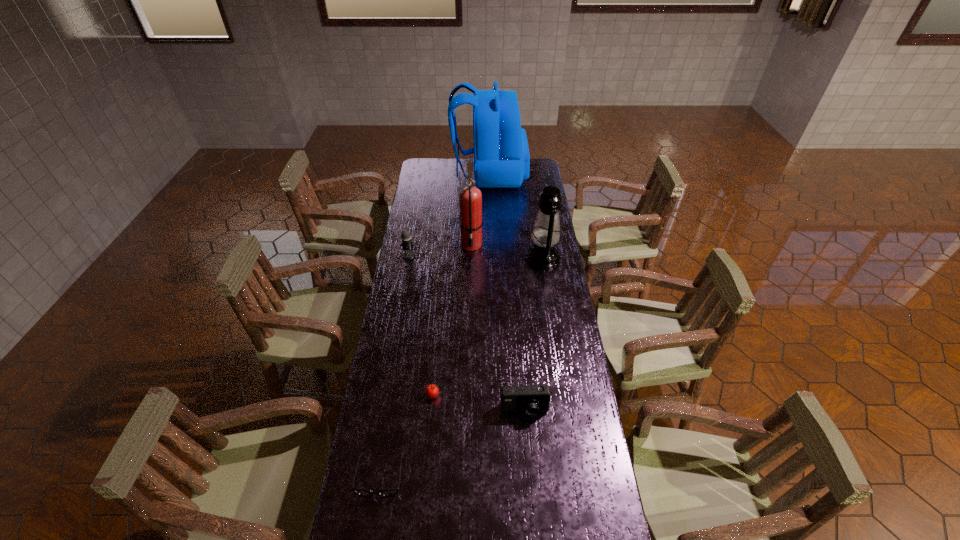
You are a GUI agent. You are given a task and a screenshot of the screen. Output one action in this format:
    pyautogui.click(x=<x>, y=<y>)
    Task: Click on the blank region between the oil lamp and the cherry
    
    Given the screenshot: What is the action you would take?
    pyautogui.click(x=488, y=327)

Locate an element on the screen. The image size is (960, 540). empty space that is in between the fire extinguisher and the microphone is located at coordinates (441, 249).

Where is `vacant area between the nearest object and the fourth tallest object`? The width and height of the screenshot is (960, 540). vacant area between the nearest object and the fourth tallest object is located at coordinates (395, 366).

Identify the location of vacant space that's between the tallest object and the camera. (507, 293).

This screenshot has height=540, width=960. In order to click on vacant space in between the fire extinguisher and the camera in this screenshot , I will do `click(498, 327)`.

Where is `vacant region between the oil lamp and the cherry`? This screenshot has width=960, height=540. vacant region between the oil lamp and the cherry is located at coordinates (488, 327).

The width and height of the screenshot is (960, 540). In order to click on vacant point located between the fourth tallest object and the camera in this screenshot , I will do `click(467, 333)`.

Find the location of a particular element. object that is the fourth nearest to the farthest object is located at coordinates (431, 390).

The width and height of the screenshot is (960, 540). In order to click on object that is the fourth closest one to the nearest object in this screenshot , I will do `click(546, 233)`.

Find the location of a particular element. The width and height of the screenshot is (960, 540). free space that satisfies the following two spatial constraints: 1. on the back of the backpack; 2. on the right side of the oil lamp is located at coordinates (492, 258).